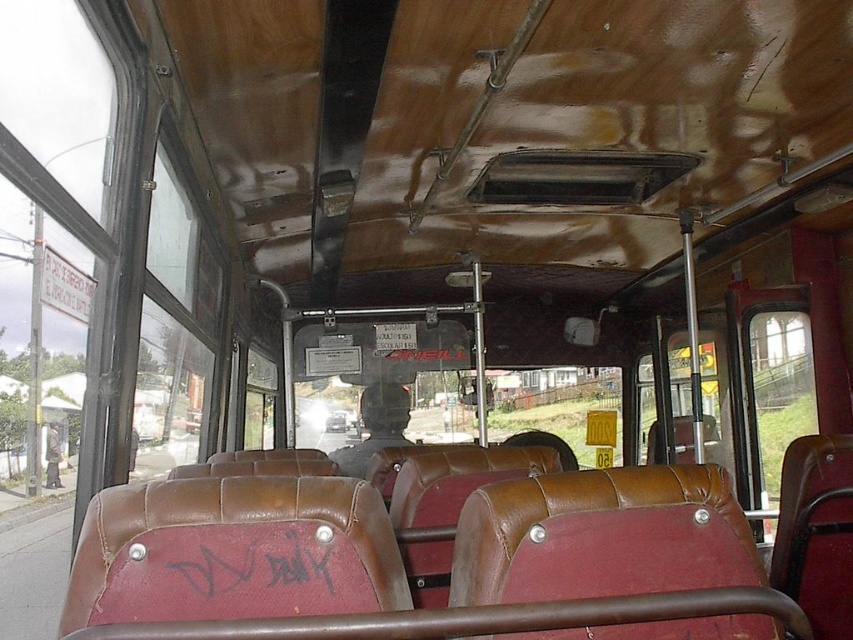
Question: Is black graffiti at center closer to the viewer compared to matte black helmet at center?

Choices:
 (A) no
 (B) yes

Answer: (B)

Question: Does black graffiti at center come behind matte black helmet at center?

Choices:
 (A) yes
 (B) no

Answer: (B)

Question: Which object appears farthest from the camera in this image?

Choices:
 (A) matte black helmet at center
 (B) black graffiti at center

Answer: (A)

Question: Is transparent glass window at left positioned before black graffiti at center?

Choices:
 (A) no
 (B) yes

Answer: (A)

Question: Which of the following is the closest to the observer?

Choices:
 (A) (402, 397)
 (B) (212, 282)
 (C) (190, 541)

Answer: (C)

Question: Among these objects, which one is nearest to the camera?

Choices:
 (A) transparent glass window at left
 (B) matte black helmet at center

Answer: (A)